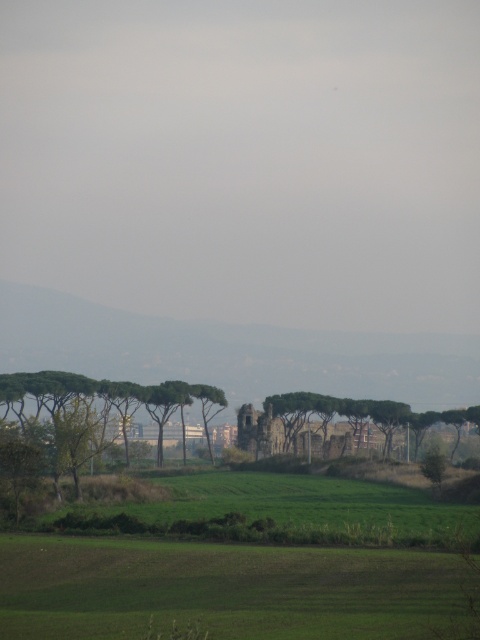
Which is more to the right, green leafy tree at left or green leafy tree at center?

green leafy tree at center is more to the right.

Between green leafy tree at left and green leafy tree at center, which one is positioned higher?

green leafy tree at center

At what (x,y) coordinates should I click in order to perform the action: click on green leafy tree at left. Please return your answer as a coordinate pair (x, y). Image resolution: width=480 pixels, height=640 pixels. Looking at the image, I should click on (91, 413).